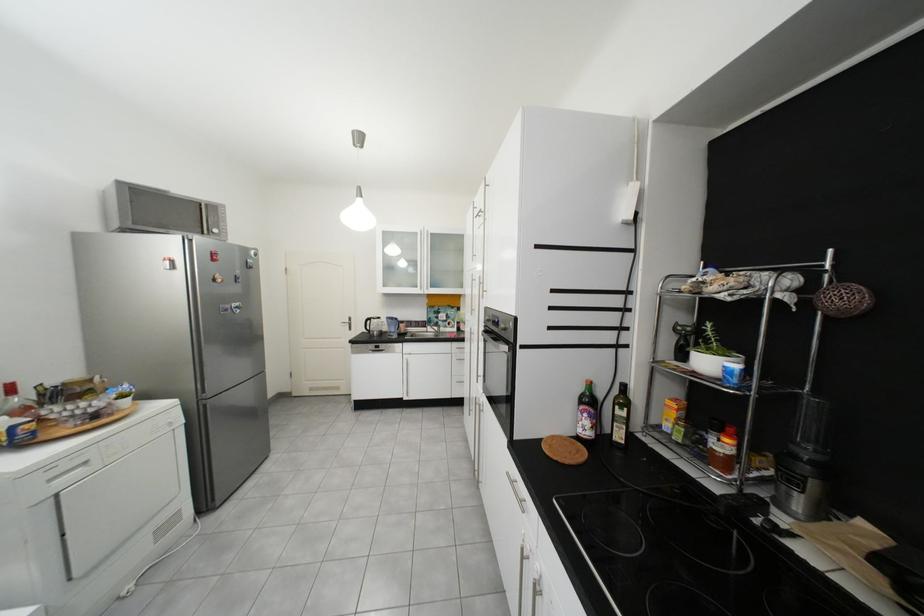
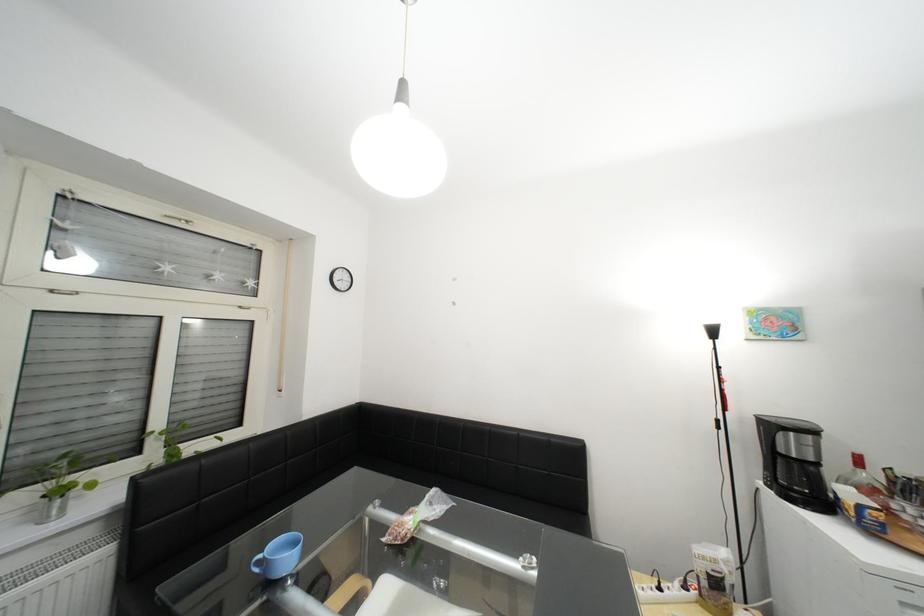
Where in the second image is the point corresponding to point 33,411 from the first image?

(881, 492)